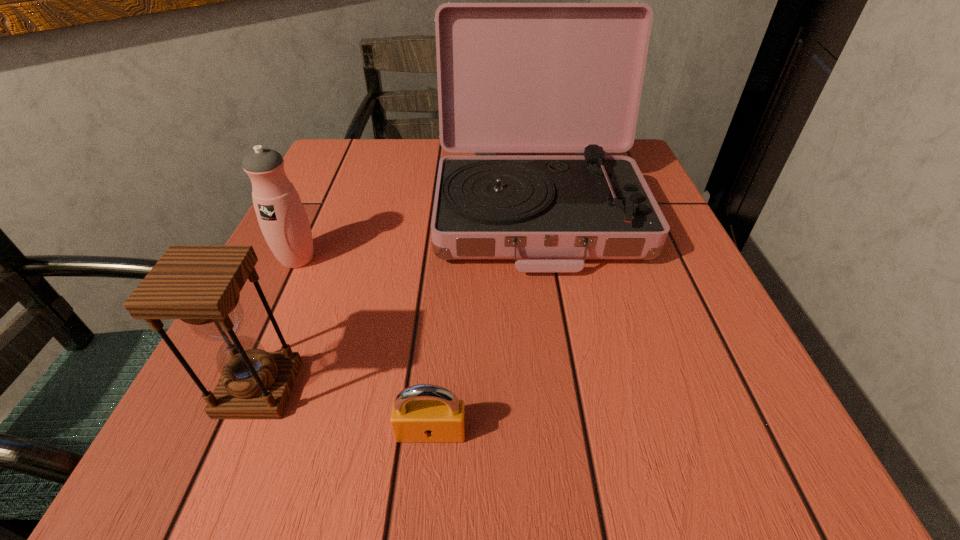
Image resolution: width=960 pixels, height=540 pixels. I want to click on object positioned at the near edge, so click(x=442, y=420).

Find the location of a particular element. thermos bottle at the left edge is located at coordinates (284, 223).

This screenshot has height=540, width=960. What are the coordinates of `hourglass located at the left edge` in the screenshot? It's located at (200, 285).

Identify the location of object present at the right edge. [x=512, y=77].

The height and width of the screenshot is (540, 960). Identify the location of object that is at the far right corner. (512, 77).

At what (x,y) coordinates should I click in order to perform the action: click on free space at the near edge of the desktop. Please return your answer as a coordinate pair (x, y). The height and width of the screenshot is (540, 960). Looking at the image, I should click on (541, 432).

Identify the location of free space at the left edge of the desktop. (340, 197).

Identify the location of free space at the right edge of the desktop. (730, 404).

In the image, there is a desktop. At what (x,y) coordinates should I click in order to perform the action: click on vacant space at the far left corner. Please return your answer as a coordinate pair (x, y). Image resolution: width=960 pixels, height=540 pixels. Looking at the image, I should click on (366, 161).

In the image, there is a desktop. Identify the location of vacant region at the near left corner. The image size is (960, 540). (178, 470).